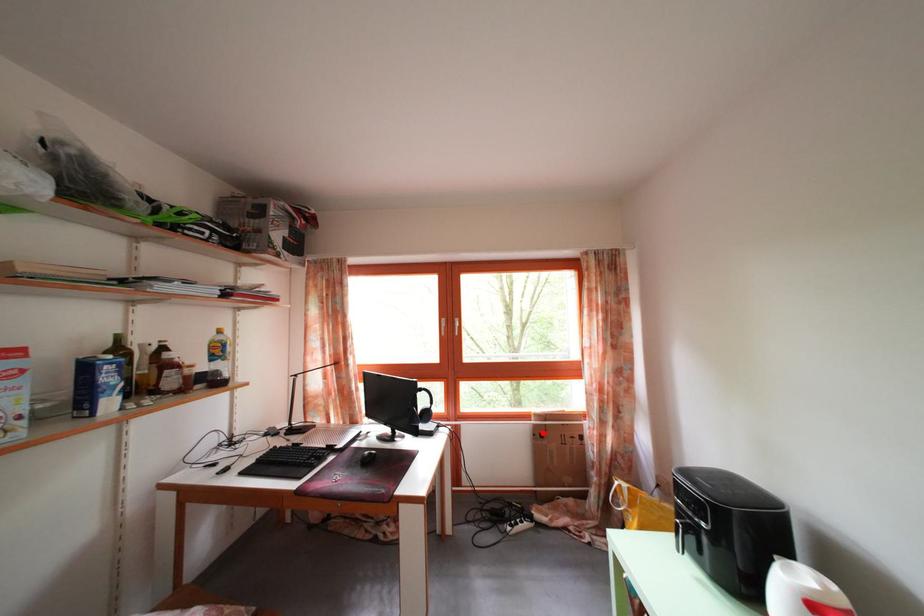
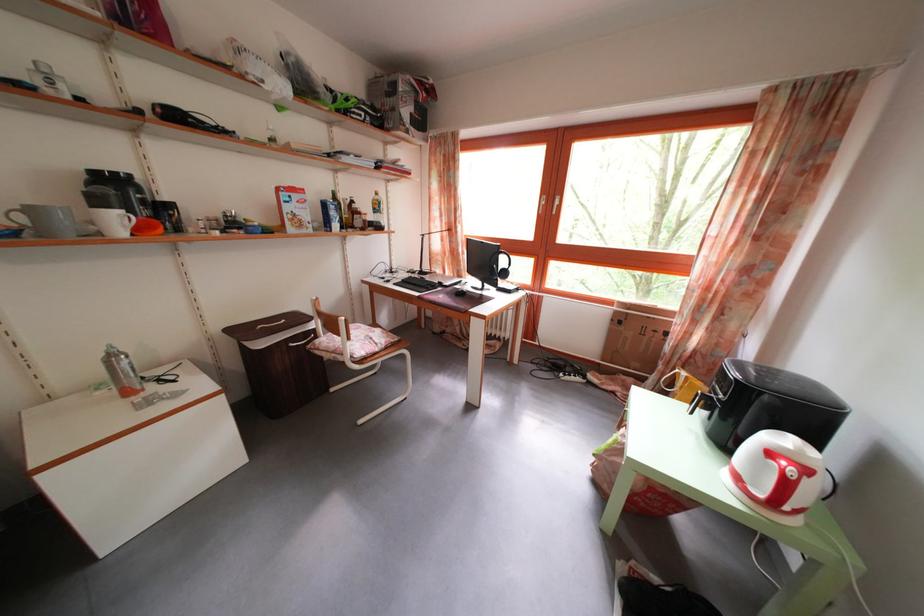
Find the pixel in the second image that matches the highlighted location in the first image.

(623, 320)